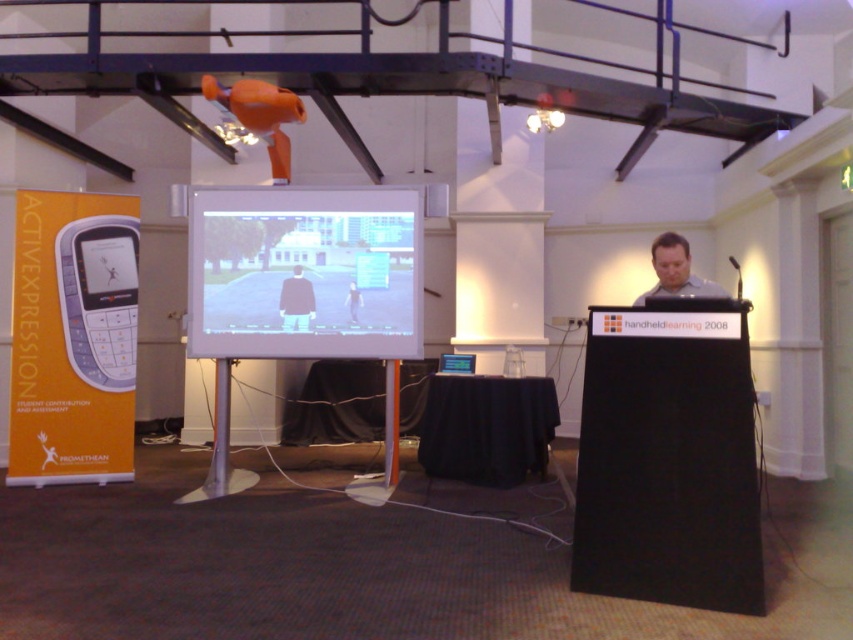
Which is above, white glossy projection screen at center or black matte jacket at center?

white glossy projection screen at center

Does white glossy projection screen at center come behind black matte jacket at center?

No, it is in front of black matte jacket at center.

In the scene shown: Who is more forward, [286,292] or [288,323]?

Positioned in front is point [286,292].

Where is `white glossy projection screen at center`? Image resolution: width=853 pixels, height=640 pixels. white glossy projection screen at center is located at coordinates (305, 273).

Is white glossy projection screen at center positioned at the back of matte black phone at center-left?

That is False.

Does point (354, 332) lie in front of point (103, 285)?

Yes, point (354, 332) is in front of point (103, 285).

From the picture: Measure the distance between white glossy projection screen at center and camera.

They are 17.41 feet apart.

Identify the location of white glossy projection screen at center. The height and width of the screenshot is (640, 853). (305, 273).

Is matte gray laptop at center bigger than matte black phone at center-left?

Indeed, matte gray laptop at center has a larger size compared to matte black phone at center-left.

Which is more to the right, matte gray laptop at center or matte black phone at center-left?

From the viewer's perspective, matte gray laptop at center appears more on the right side.

Is point (660, 285) farther from camera compared to point (122, 266)?

No, it is not.

Where is `matte gray laptop at center`? matte gray laptop at center is located at coordinates (676, 269).